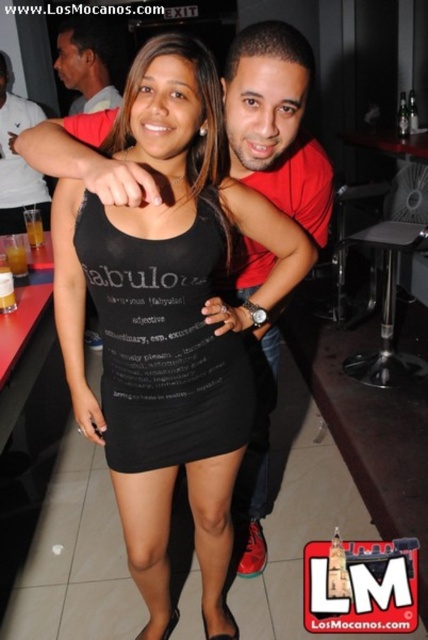
Question: Is the position of black matte tank top at center more distant than that of white matte t-shirt at upper center?

Choices:
 (A) yes
 (B) no

Answer: (B)

Question: In this image, where is black matte tank top at center located relative to white matte t-shirt at upper center?

Choices:
 (A) below
 (B) above

Answer: (A)

Question: Considering the relative positions of black matte tank top at center and matte black shirt at upper left in the image provided, where is black matte tank top at center located with respect to matte black shirt at upper left?

Choices:
 (A) right
 (B) left

Answer: (A)

Question: Which point is closer to the camera taking this photo?

Choices:
 (A) (133, 396)
 (B) (59, 76)
 (C) (0, 173)
 (D) (157, 243)

Answer: (D)

Question: Which point is farther to the camera?

Choices:
 (A) (181, 253)
 (B) (21, 173)
 (C) (89, 51)
 (D) (163, 170)

Answer: (B)

Question: Among these objects, which one is nearest to the camera?

Choices:
 (A) matte black shirt at upper left
 (B) black matte tank top at center
 (C) black fabric dress at center

Answer: (C)